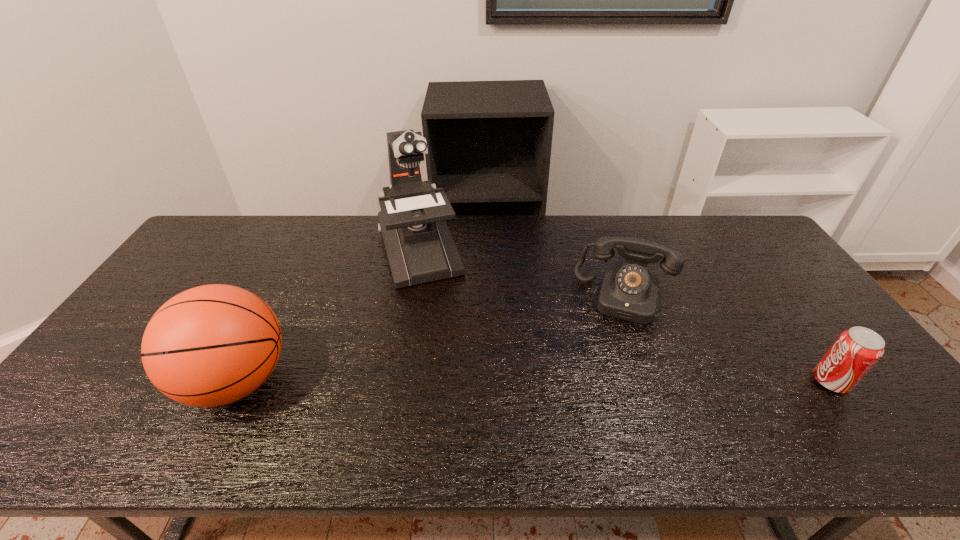
Locate an element on the screen. This screenshot has width=960, height=540. free space between the telephone and the tallest object is located at coordinates (522, 273).

Where is `empty location between the leftmost object and the soda can`? The image size is (960, 540). empty location between the leftmost object and the soda can is located at coordinates tap(534, 381).

The width and height of the screenshot is (960, 540). In order to click on blank region between the microscope and the leftmost object in this screenshot , I will do `click(328, 315)`.

The image size is (960, 540). What are the coordinates of `empty space between the leftmost object and the soda can` in the screenshot? It's located at 534,381.

Find the location of a particular element. This screenshot has width=960, height=540. vacant space in between the microscope and the telephone is located at coordinates (522, 273).

In order to click on free space between the microscope and the basketball in this screenshot , I will do pyautogui.click(x=328, y=315).

The image size is (960, 540). Find the location of `object that is the third nearest to the basketball`. object that is the third nearest to the basketball is located at coordinates (856, 350).

Locate an element on the screen. object that ranks as the second closest to the third object from left to right is located at coordinates click(x=419, y=246).

The height and width of the screenshot is (540, 960). I want to click on free space that satisfies the following two spatial constraints: 1. on the front side of the basketball; 2. on the logo side of the soda can, so click(237, 381).

At what (x,y) coordinates should I click in order to perform the action: click on vacant space that satisfies the following two spatial constraints: 1. on the front side of the microscope; 2. on the right side of the telephone. Please return your answer as a coordinate pair (x, y). This screenshot has width=960, height=540. Looking at the image, I should click on (412, 297).